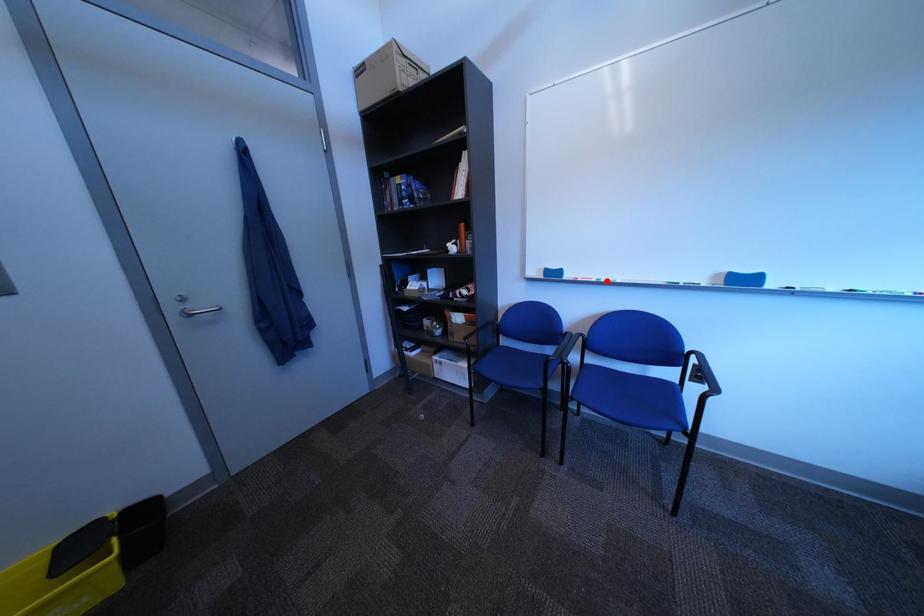
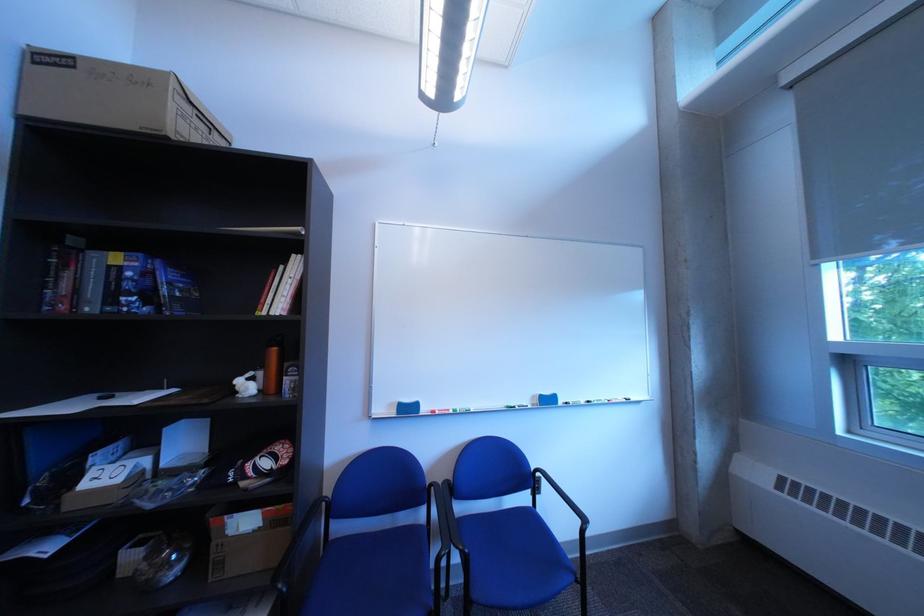
Find the pixel in the second image that matches the highlighted location in the first image.

(465, 411)